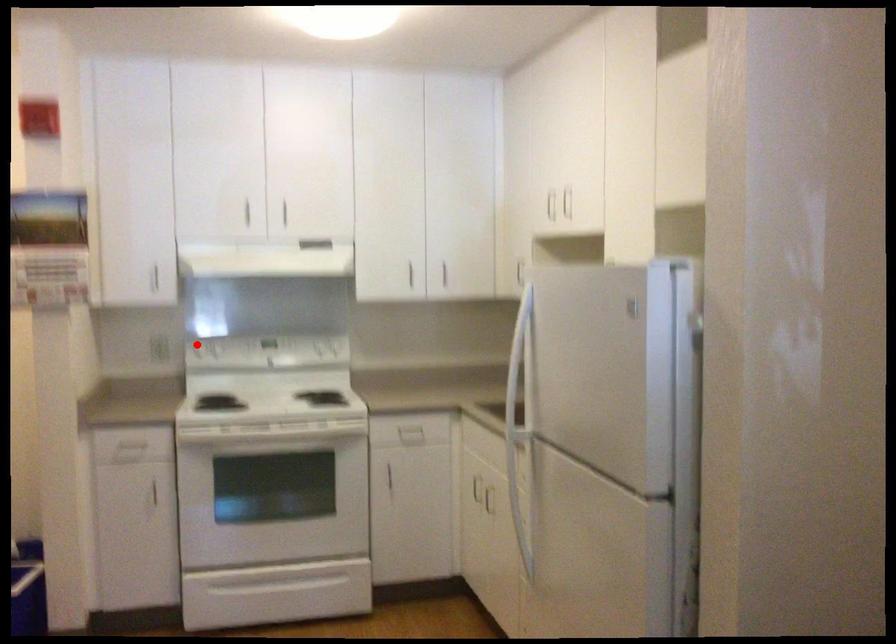
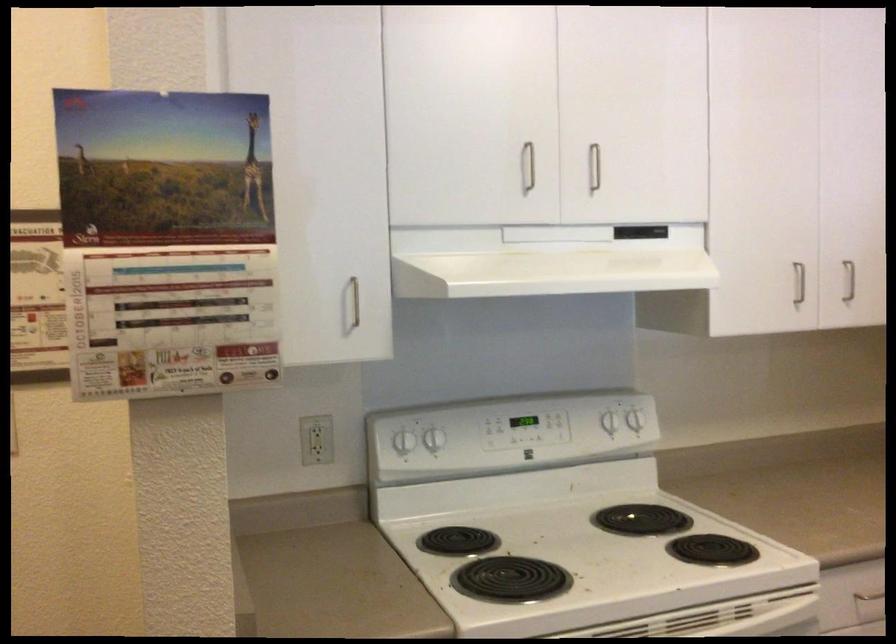
In the second image, find the point that corresponds to the highlighted location in the first image.

(400, 433)